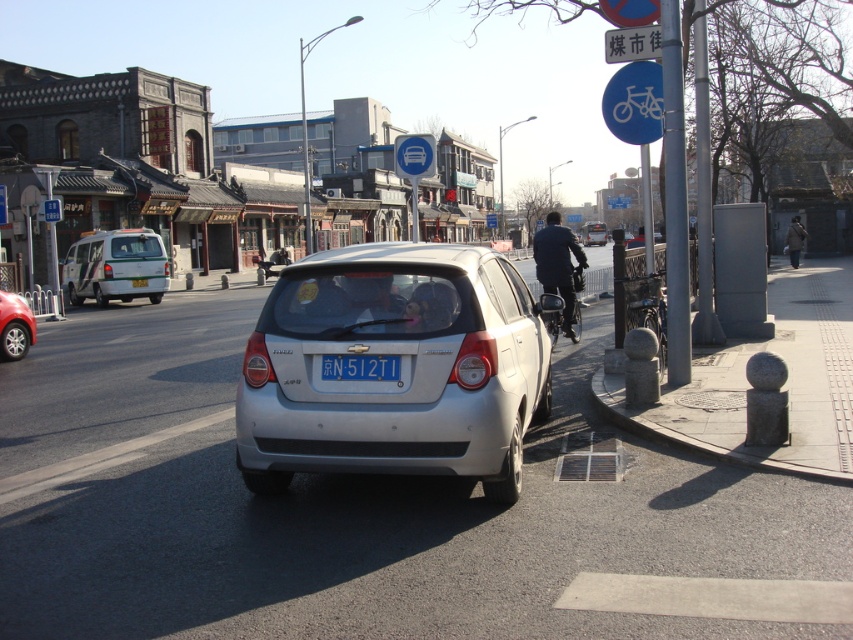
Who is positioned more to the right, white plastic license plate at center or brown leather jacket at center?

Positioned to the right is brown leather jacket at center.

Can you confirm if white plastic license plate at center is thinner than brown leather jacket at center?

Yes, white plastic license plate at center is thinner than brown leather jacket at center.

Which is in front, point (358, 362) or point (791, 266)?

Point (358, 362) is more forward.

The image size is (853, 640). I want to click on white plastic license plate at center, so click(x=360, y=368).

Does green matte van at center-left come behind brown leather jacket at center?

No, it is in front of brown leather jacket at center.

Which of these two, green matte van at center-left or brown leather jacket at center, stands taller?

Standing taller between the two is brown leather jacket at center.

Does point (123, 241) come closer to viewer compared to point (798, 268)?

Yes.

Where is `green matte van at center-left`? The image size is (853, 640). green matte van at center-left is located at coordinates (115, 266).

Between point (799, 237) and point (141, 284), which one is positioned in front?

Point (141, 284) is in front.

Between point (793, 230) and point (135, 278), which one is positioned in front?

Point (135, 278) is in front.

Locate an element on the screen. brown leather jacket at center is located at coordinates tap(793, 241).